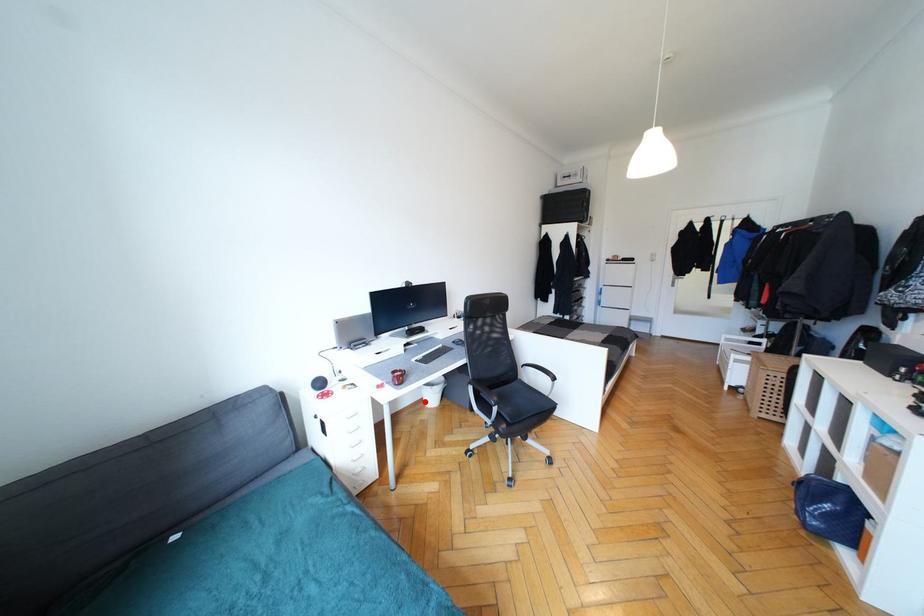
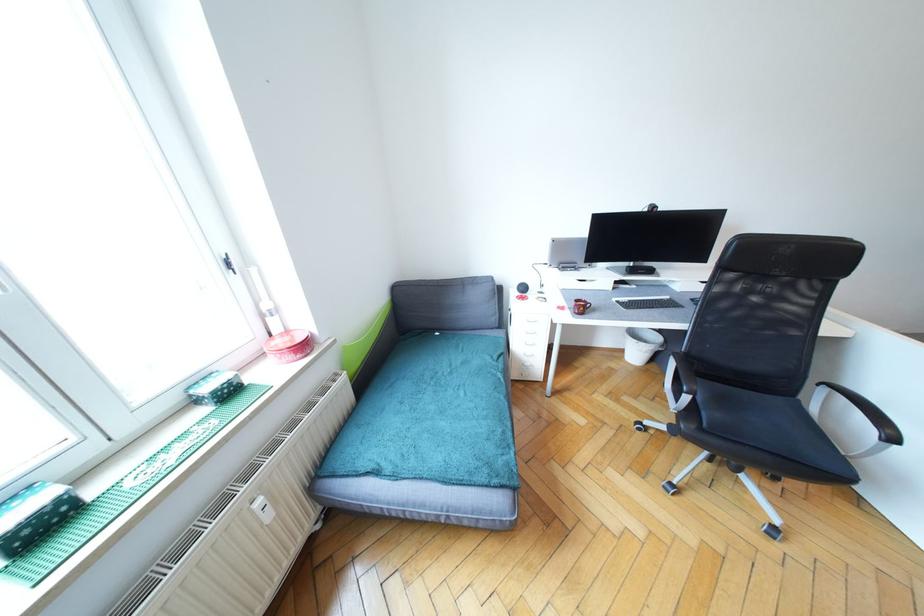
Where in the second image is the point corresponding to the highlighted location from the first image?

(625, 352)